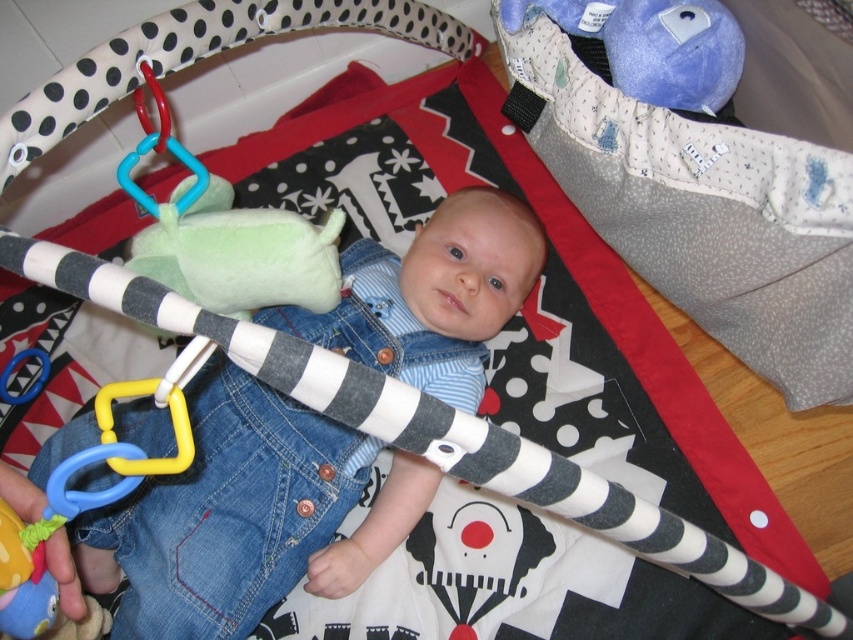
Question: Is the position of denim overalls at center more distant than that of green plush toy at center?

Choices:
 (A) no
 (B) yes

Answer: (B)

Question: Which point appears closest to the camera in this image?

Choices:
 (A) (181, 572)
 (B) (288, 268)

Answer: (B)

Question: Is denim overalls at center positioned behind green plush toy at center?

Choices:
 (A) no
 (B) yes

Answer: (B)

Question: Is denim overalls at center further to camera compared to green plush toy at center?

Choices:
 (A) no
 (B) yes

Answer: (B)

Question: Which object is farther from the camera taking this photo?

Choices:
 (A) denim overalls at center
 (B) green plush toy at center

Answer: (A)